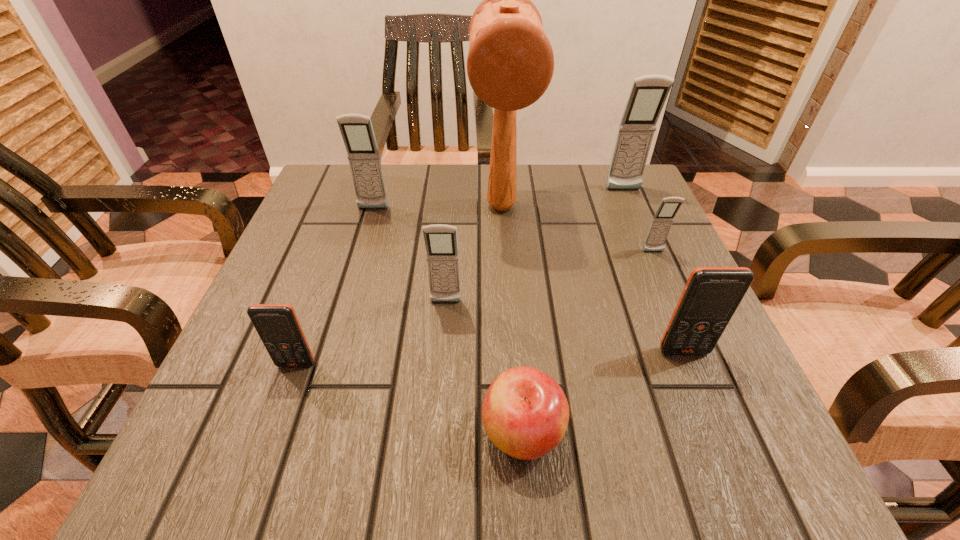
Find the location of a particular element. vacant space at the right edge is located at coordinates (672, 246).

The image size is (960, 540). I want to click on free location at the far left corner of the desktop, so click(331, 170).

Where is `vacant space at the near left corner of the desktop`? vacant space at the near left corner of the desktop is located at coordinates (257, 461).

At what (x,y) coordinates should I click in order to perform the action: click on vacant region at the far right corner of the desktop. Please return your answer as a coordinate pair (x, y). Looking at the image, I should click on (587, 219).

Identify the location of vacant region between the farthest gray cellular telephone and the third object from left to right. This screenshot has width=960, height=540. (535, 246).

Where is `free space between the fourth cellular telephone from right to left and the right orange cellular telephone`? free space between the fourth cellular telephone from right to left and the right orange cellular telephone is located at coordinates (564, 327).

Image resolution: width=960 pixels, height=540 pixels. What are the coordinates of `vacant space that is in between the second nearest gray cellular telephone and the tallest object` in the screenshot? It's located at (578, 230).

Find the location of a particular element. The width and height of the screenshot is (960, 540). free space between the apple and the fifth nearest object is located at coordinates (588, 342).

You are a GUI agent. You are given a task and a screenshot of the screen. Output one action in this format:
    pyautogui.click(x=<x>, y=<y>)
    Task: Click on the vacant region between the tallest cellular telephone and the sixth farthest object
    The image size is (960, 540).
    Given the screenshot: What is the action you would take?
    pyautogui.click(x=654, y=271)

Where is `vacant space that's between the third farthest cellular telephone and the nearest cellular telephone`? The image size is (960, 540). vacant space that's between the third farthest cellular telephone and the nearest cellular telephone is located at coordinates (475, 308).